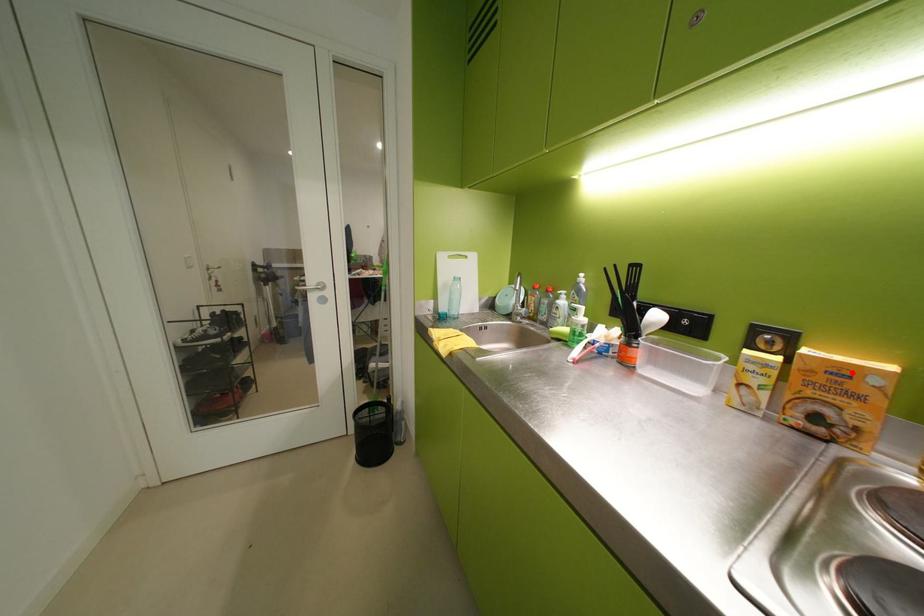
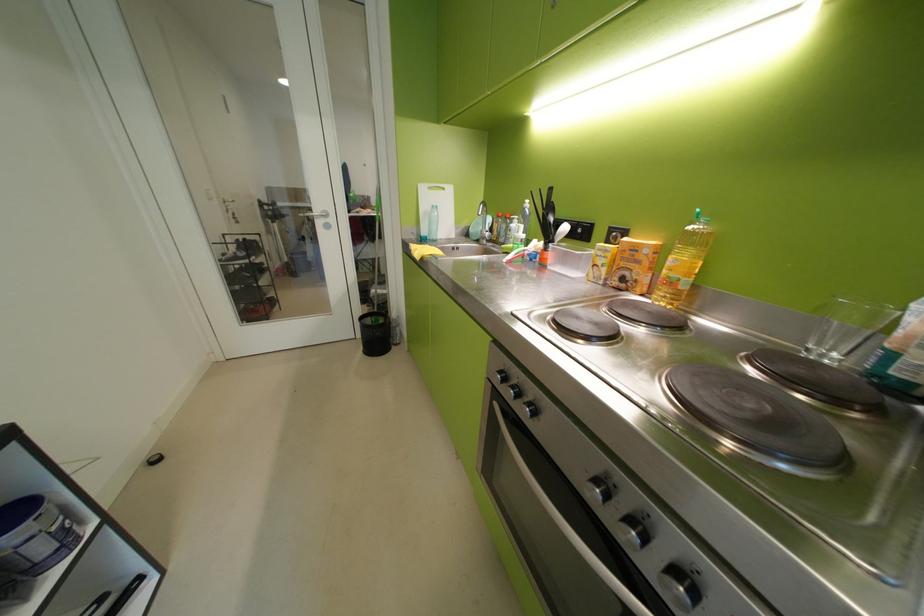
In the second image, find the point that corresponds to the highlighted location in the first image.

(646, 249)